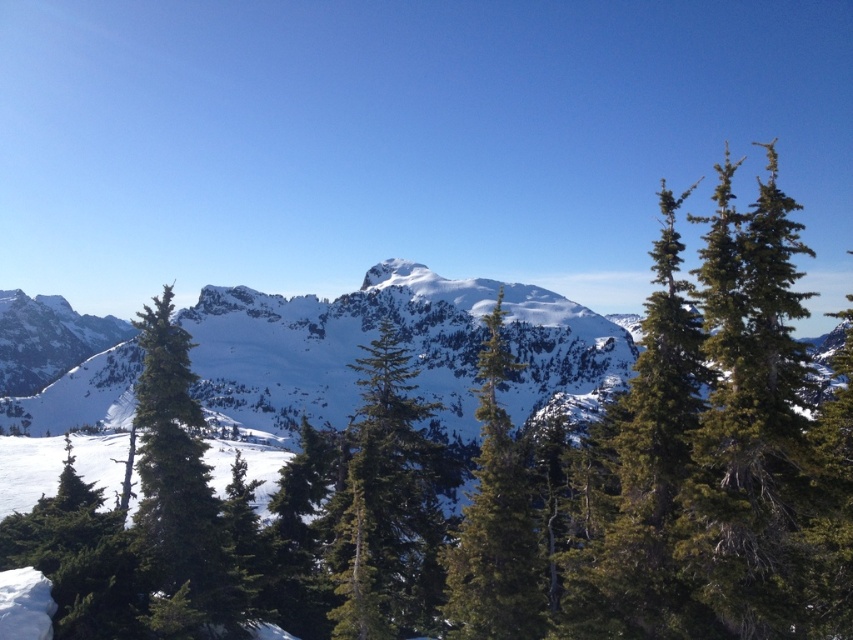
You are an outdoor photographer standing in the mountain landscape. You want to capture a photo that includes both the green textured tree at center and the green textured pine tree at center. Which tree should you move closer to in order to have both trees clearly visible in your photo?

You should move closer to the green textured pine tree at center because the green textured tree at center is in front of it, so moving closer to the pine tree would help ensure both are in focus and clearly visible.

You are an environmental researcher studying the growth patterns of trees in mountainous regions. You observe a green textured tree at center and a green textured pine tree at center in the image. Which of these two trees has a greater height?

The green textured tree at center is larger in size than the green textured pine tree at center, so it has a greater height.